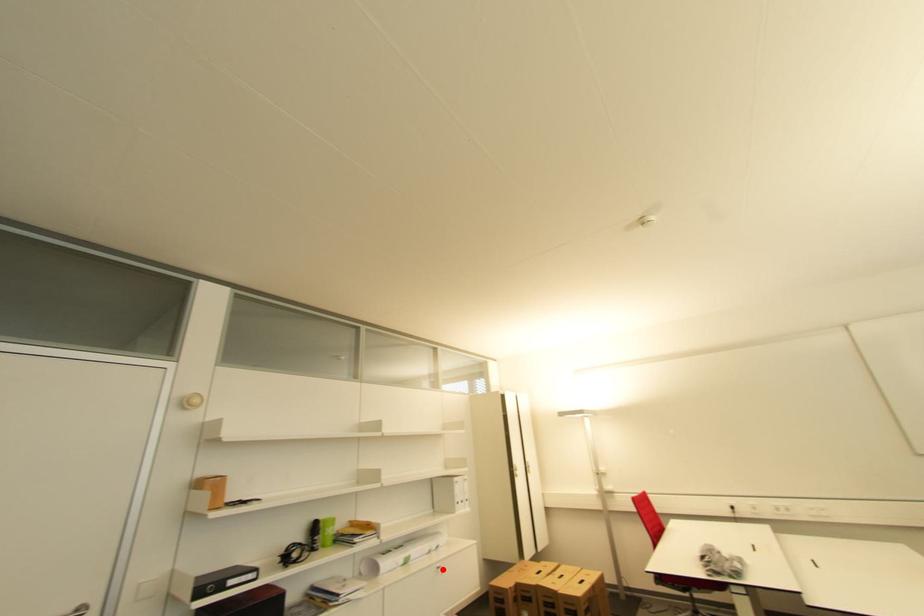
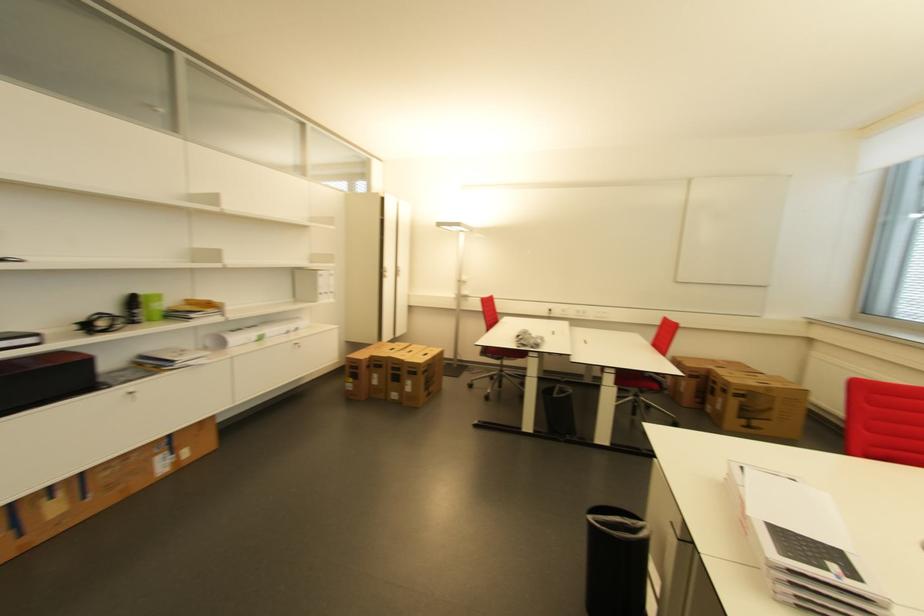
Locate, in the second image, the point that corresponds to the highlighted location in the first image.

(300, 345)